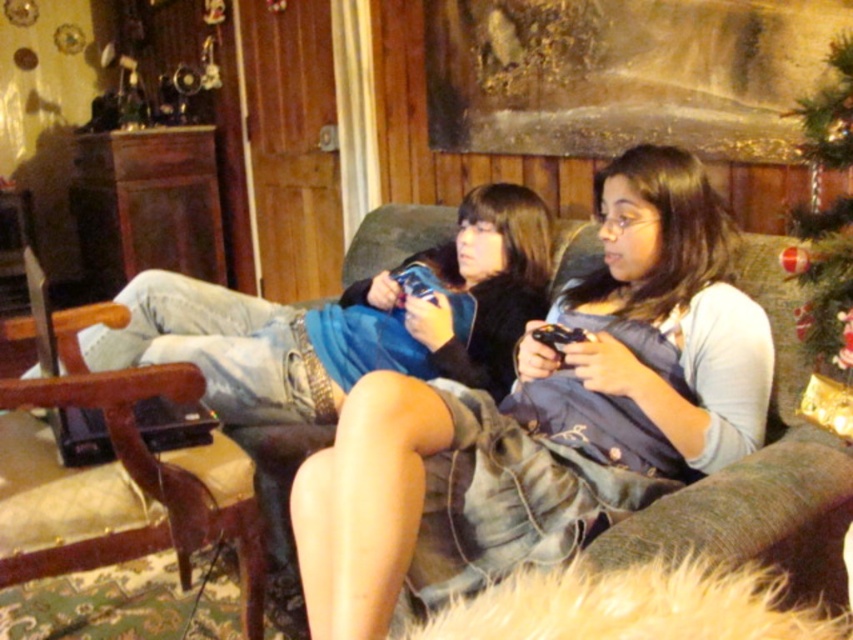
Question: Can you confirm if denim shorts at center is positioned above green fabric christmas tree at upper right?

Choices:
 (A) yes
 (B) no

Answer: (B)

Question: Is denim shorts at center positioned behind green fabric christmas tree at upper right?

Choices:
 (A) no
 (B) yes

Answer: (A)

Question: Which point is closer to the camera?

Choices:
 (A) green fabric christmas tree at upper right
 (B) denim shorts at center

Answer: (B)

Question: Is denim shorts at center below green fabric christmas tree at upper right?

Choices:
 (A) no
 (B) yes

Answer: (B)

Question: Which object is closer to the camera taking this photo?

Choices:
 (A) denim shorts at center
 (B) green fabric christmas tree at upper right

Answer: (A)